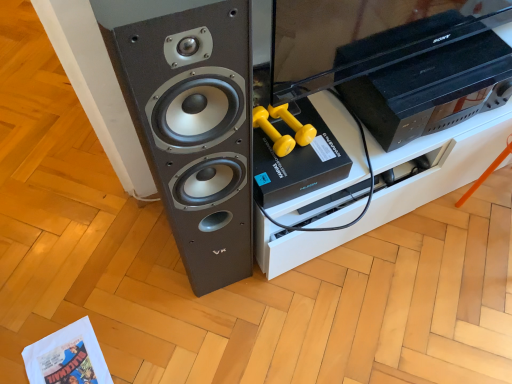
Question: Considering the relative sizes of black plastic sony tv at upper right and black plastic tv stand at center in the image provided, is black plastic sony tv at upper right wider than black plastic tv stand at center?

Choices:
 (A) yes
 (B) no

Answer: (B)

Question: From a real-world perspective, does black plastic sony tv at upper right stand above black plastic tv stand at center?

Choices:
 (A) yes
 (B) no

Answer: (A)

Question: Does black plastic sony tv at upper right appear on the right side of black plastic tv stand at center?

Choices:
 (A) no
 (B) yes

Answer: (B)

Question: Is black plastic sony tv at upper right oriented away from black plastic tv stand at center?

Choices:
 (A) yes
 (B) no

Answer: (B)

Question: Does black plastic sony tv at upper right have a greater height compared to black plastic tv stand at center?

Choices:
 (A) no
 (B) yes

Answer: (A)

Question: In the image, is black plastic sony tv at upper right on the left side or the right side of black plastic tv stand at center?

Choices:
 (A) right
 (B) left

Answer: (A)

Question: Looking at their shapes, would you say black plastic sony tv at upper right is wider or thinner than black plastic tv stand at center?

Choices:
 (A) wide
 (B) thin

Answer: (B)

Question: Is black plastic sony tv at upper right situated inside black plastic tv stand at center or outside?

Choices:
 (A) outside
 (B) inside

Answer: (A)

Question: Considering the positions of black plastic sony tv at upper right and black plastic tv stand at center in the image, is black plastic sony tv at upper right bigger or smaller than black plastic tv stand at center?

Choices:
 (A) small
 (B) big

Answer: (A)

Question: Is point (207, 13) closer or farther from the camera than point (419, 185)?

Choices:
 (A) farther
 (B) closer

Answer: (B)

Question: From the image's perspective, is matte black speaker at left positioned above or below black plastic tv stand at center?

Choices:
 (A) below
 (B) above

Answer: (A)

Question: From a real-world perspective, is matte black speaker at left above or below black plastic tv stand at center?

Choices:
 (A) above
 (B) below

Answer: (A)

Question: Is matte black speaker at left inside the boundaries of black plastic tv stand at center, or outside?

Choices:
 (A) inside
 (B) outside

Answer: (B)

Question: From a real-world perspective, is matte black speaker at left positioned above or below black plastic sony tv at upper right?

Choices:
 (A) below
 (B) above

Answer: (B)

Question: Choose the correct answer: Is matte black speaker at left inside black plastic sony tv at upper right or outside it?

Choices:
 (A) inside
 (B) outside

Answer: (B)